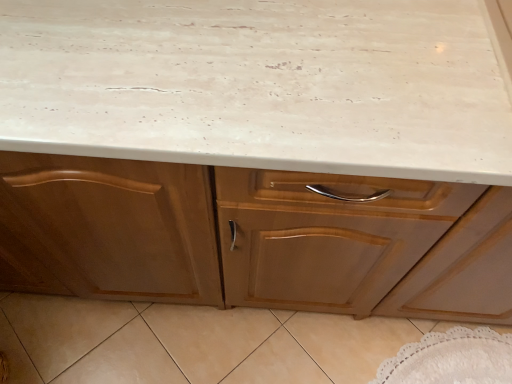
Locate an element on the screen. The image size is (512, 384). white marble countertop at center is located at coordinates (260, 85).

The height and width of the screenshot is (384, 512). What do you see at coordinates (260, 85) in the screenshot?
I see `white marble countertop at center` at bounding box center [260, 85].

Locate an element on the screen. This screenshot has height=384, width=512. white marble countertop at center is located at coordinates 260,85.